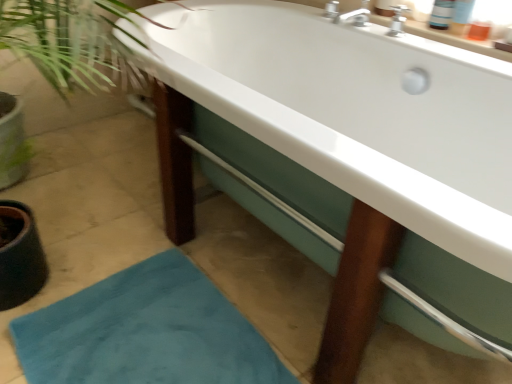
Identify the location of white glossy bathtub at center. The width and height of the screenshot is (512, 384). (354, 111).

Describe the element at coordinates (354, 111) in the screenshot. The image size is (512, 384). I see `white glossy bathtub at center` at that location.

Describe the element at coordinates (146, 332) in the screenshot. This screenshot has height=384, width=512. I see `teal plush bath mat at lower left` at that location.

Where is `teal plush bath mat at lower left`? Image resolution: width=512 pixels, height=384 pixels. teal plush bath mat at lower left is located at coordinates click(146, 332).

In order to click on white glossy bathtub at center in this screenshot , I will do `click(354, 111)`.

Which object is positioned more to the right, teal plush bath mat at lower left or white glossy bathtub at center?

Result: Positioned to the right is white glossy bathtub at center.

Relative to white glossy bathtub at center, is teal plush bath mat at lower left in front or behind?

In the image, teal plush bath mat at lower left appears behind white glossy bathtub at center.

Does point (28, 372) come in front of point (367, 67)?

Yes, it is in front of point (367, 67).

From the image's perspective, which object appears higher, teal plush bath mat at lower left or white glossy bathtub at center?

white glossy bathtub at center appears higher in the image.

From a real-world perspective, is teal plush bath mat at lower left positioned above or below white glossy bathtub at center?

teal plush bath mat at lower left is situated lower than white glossy bathtub at center in the real world.

Between teal plush bath mat at lower left and white glossy bathtub at center, which one has larger width?

white glossy bathtub at center.

Can you confirm if teal plush bath mat at lower left is shorter than white glossy bathtub at center?

Yes, teal plush bath mat at lower left is shorter than white glossy bathtub at center.

Is teal plush bath mat at lower left bigger than white glossy bathtub at center?

Actually, teal plush bath mat at lower left might be smaller than white glossy bathtub at center.

Is white glossy bathtub at center a part of teal plush bath mat at lower left?

No.

Is teal plush bath mat at lower left beside white glossy bathtub at center?

teal plush bath mat at lower left and white glossy bathtub at center are not in contact.

Is teal plush bath mat at lower left positioned with its back to white glossy bathtub at center?

Absolutely, teal plush bath mat at lower left is directed away from white glossy bathtub at center.

Can you tell me how much teal plush bath mat at lower left and white glossy bathtub at center differ in facing direction?

The angle between the facing direction of teal plush bath mat at lower left and the facing direction of white glossy bathtub at center is 3.5 degrees.

Measure the distance between teal plush bath mat at lower left and white glossy bathtub at center.

69.14 centimeters.

Find the location of a particular element. bath mat that appears below the white glossy bathtub at center (from the image's perspective) is located at coordinates (146, 332).

Can you confirm if white glossy bathtub at center is positioned to the left of teal plush bath mat at lower left?

No, white glossy bathtub at center is not to the left of teal plush bath mat at lower left.

Considering their positions, is white glossy bathtub at center located in front of or behind teal plush bath mat at lower left?

Visually, white glossy bathtub at center is located in front of teal plush bath mat at lower left.

Between point (480, 57) and point (83, 299), which one is positioned in front?

The point (83, 299) is closer to the camera.

Consider the image. From the image's perspective, which one is positioned lower, white glossy bathtub at center or teal plush bath mat at lower left?

From the image's view, teal plush bath mat at lower left is below.

From a real-world perspective, is white glossy bathtub at center on teal plush bath mat at lower left?

Indeed, from a real-world perspective, white glossy bathtub at center stands above teal plush bath mat at lower left.

Which of these two, white glossy bathtub at center or teal plush bath mat at lower left, is thinner?

teal plush bath mat at lower left is thinner.

Considering the relative sizes of white glossy bathtub at center and teal plush bath mat at lower left in the image provided, is white glossy bathtub at center taller than teal plush bath mat at lower left?

Yes, white glossy bathtub at center is taller than teal plush bath mat at lower left.

Who is bigger, white glossy bathtub at center or teal plush bath mat at lower left?

white glossy bathtub at center.

Is white glossy bathtub at center surrounding teal plush bath mat at lower left?

No.

Is white glossy bathtub at center not near teal plush bath mat at lower left?

No, white glossy bathtub at center is not far away from teal plush bath mat at lower left.

Is teal plush bath mat at lower left at the back of white glossy bathtub at center?

That's not correct — white glossy bathtub at center is not looking away from teal plush bath mat at lower left.

Find the location of a particular element. bath mat on the left of the white glossy bathtub at center is located at coordinates (146, 332).

Find the location of a particular element. bathtub lying on the right of teal plush bath mat at lower left is located at coordinates (354, 111).

Locate an element on the screen. The image size is (512, 384). bath mat below the white glossy bathtub at center (from a real-world perspective) is located at coordinates (146, 332).